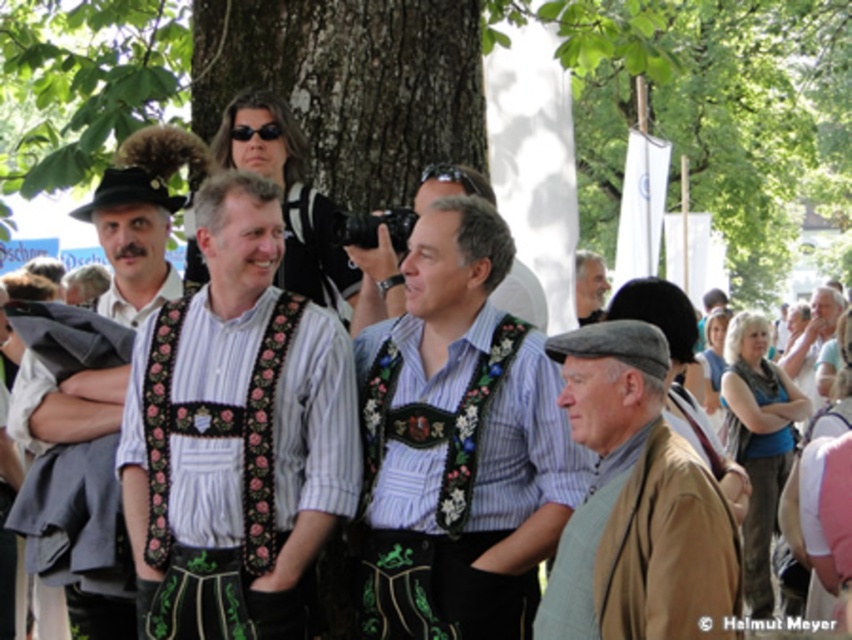
In the scene shown: Can you confirm if embroidered fabric vest at center is thinner than matte black vest at left?

Indeed, embroidered fabric vest at center has a lesser width compared to matte black vest at left.

Which is more to the right, embroidered fabric vest at center or matte black vest at left?

embroidered fabric vest at center

Which is in front, point (245, 406) or point (130, 250)?

Point (245, 406) is in front.

Identify the location of embroidered fabric vest at center. This screenshot has width=852, height=640. (235, 435).

Can you confirm if embroidered fabric vest at center is shorter than brown woolen hat at lower right?

No.

Who is shorter, embroidered fabric vest at center or brown woolen hat at lower right?

Standing shorter between the two is brown woolen hat at lower right.

Does point (223, 460) lie in front of point (642, 540)?

That is False.

Locate an element on the screen. embroidered fabric vest at center is located at coordinates (235, 435).

Image resolution: width=852 pixels, height=640 pixels. What do you see at coordinates (458, 444) in the screenshot? I see `embroidered fabric shirt at center` at bounding box center [458, 444].

You are a GUI agent. You are given a task and a screenshot of the screen. Output one action in this format:
    pyautogui.click(x=<x>, y=<y>)
    Task: Click on the embroidered fabric shirt at center
    The image size is (852, 640).
    Given the screenshot: What is the action you would take?
    pyautogui.click(x=458, y=444)

Locate an element on the screen. The height and width of the screenshot is (640, 852). embroidered fabric shirt at center is located at coordinates (458, 444).